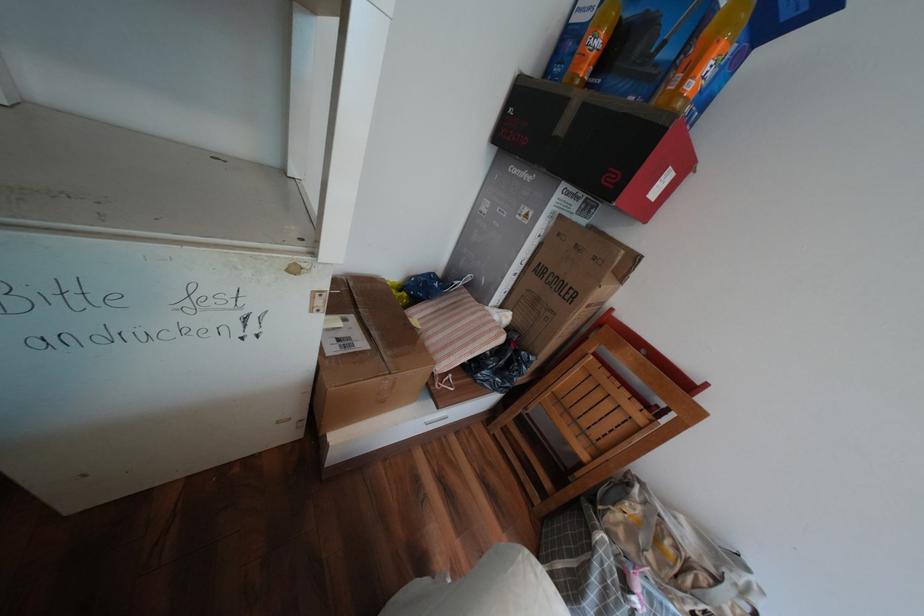
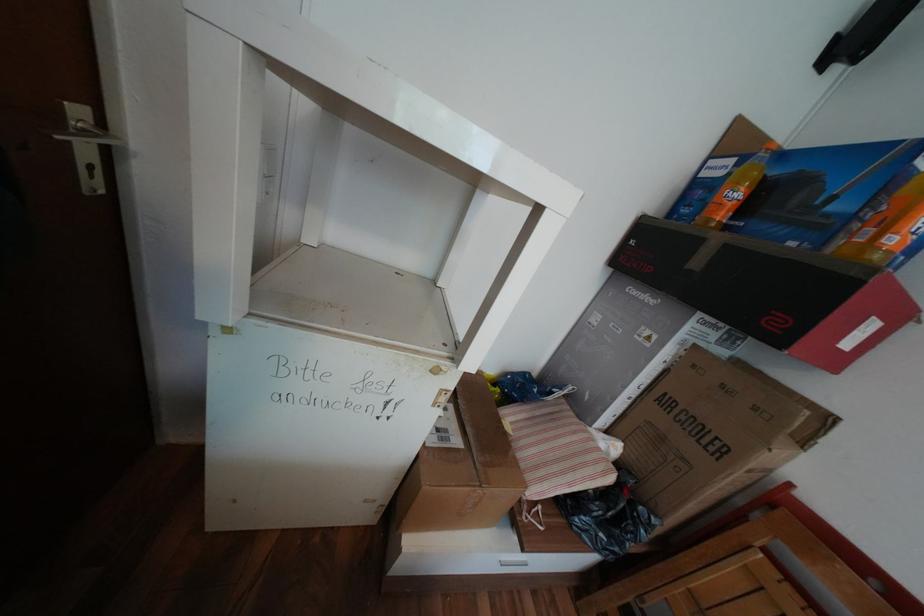
In the second image, find the point that corresponds to the point at 608,43 in the first image.

(748, 195)